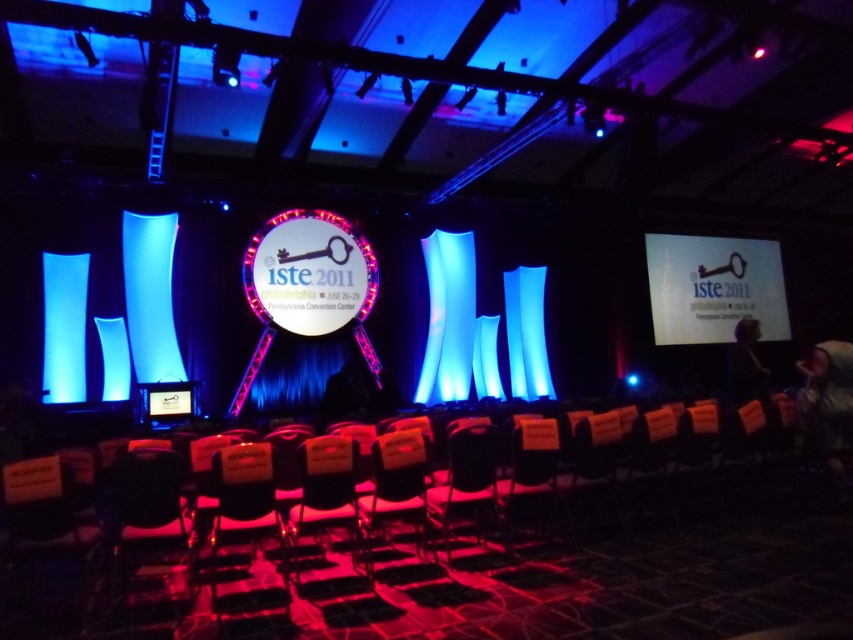
You are an event organizer who needs to place a 12 inch wide decorative banner between the orange fabric chair at center and the black plastic chair at center on stage. Is there enough space to fit the banner without moving the chairs?

The distance between the orange fabric chair at center and the black plastic chair at center is 10.60 inches, which is less than the 12 inch width of the banner. Therefore, there is not enough space to fit the banner between them without moving the chairs.

You are an event organizer who needs to arrange a panel discussion. You have two chairs available on stage, an orange fabric chair at center and a black plastic chair at center. If you want to seat a guest to your immediate right, which chair should you place them in?

The orange fabric chair at center is to the left of the black plastic chair at center. Therefore, to seat a guest to your immediate right, you should place them in the black plastic chair at center.

Looking at this image, you are an event coordinator checking the stage setup for the ISTE 2011 conference. You notice the white matte projection screen at upper center and the black plastic chair at center. Which object is closer to the audience sitting in front of the stage?

The white matte projection screen at upper center is closer to the audience because the black plastic chair at center is behind it.